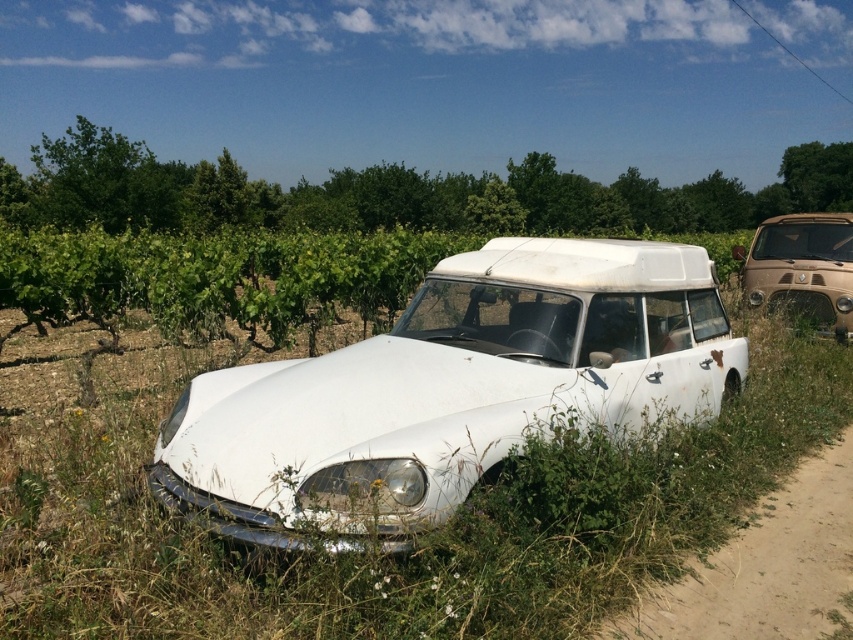
You are a photographer planning to capture a wide shot of the white Citroen DS in the foreground. To ensure the dirt track at lower right is visible in the frame, where should you position yourself relative to the car?

The dirt track at lower right is located at point 0.897 on the horizontal axis and 0.886 on the vertical axis, so to include it in the frame, you should position yourself to the lower right of the white Citroen DS.